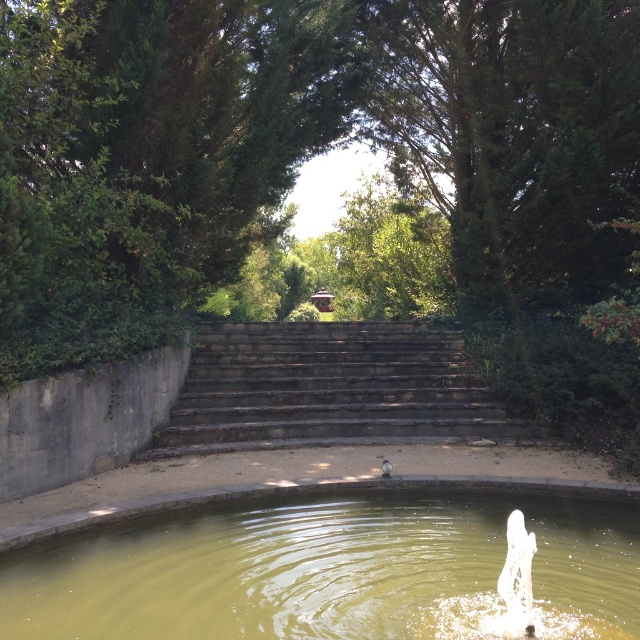
Question: Does greenish water at center have a smaller size compared to dark gray stone stairs at center?

Choices:
 (A) no
 (B) yes

Answer: (A)

Question: Among these points, which one is farthest from the camera?

Choices:
 (A) (61, 564)
 (B) (449, 428)

Answer: (B)

Question: From the image, what is the correct spatial relationship of greenish water at center in relation to dark gray stone stairs at center?

Choices:
 (A) above
 (B) below

Answer: (B)

Question: Does greenish water at center appear on the left side of dark gray stone stairs at center?

Choices:
 (A) no
 (B) yes

Answer: (B)